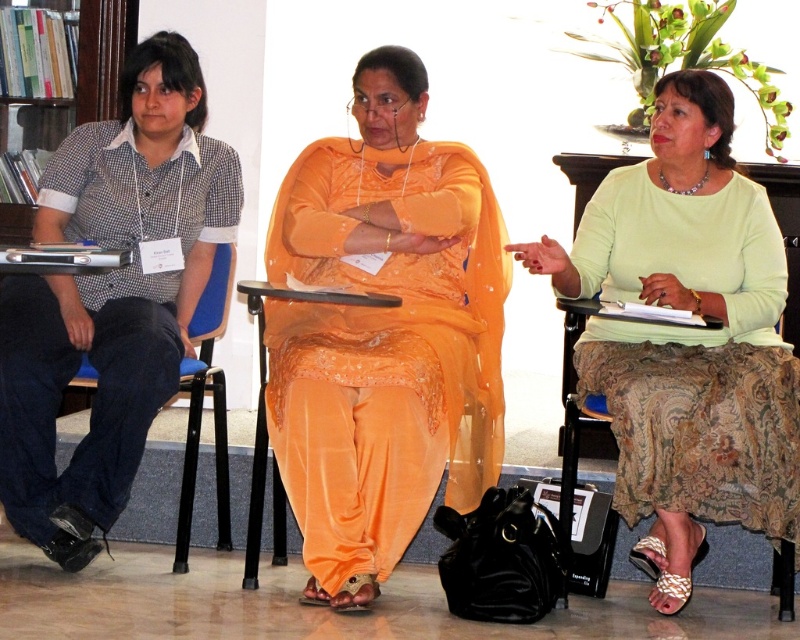
Question: Does orange silk dress at center lie behind green satin blouse at center?

Choices:
 (A) no
 (B) yes

Answer: (B)

Question: Which object is positioned closest to the paisley-patterned fabric chair at lower right?

Choices:
 (A) checkered fabric shirt at left
 (B) orange silk dress at center

Answer: (B)

Question: Which point is farther from the camera taking this photo?

Choices:
 (A) (52, 282)
 (B) (202, 346)
 (C) (570, 371)

Answer: (C)

Question: Is orange silk dress at center closer to camera compared to blue fabric chair at left?

Choices:
 (A) yes
 (B) no

Answer: (A)

Question: Which point is farther from the camera taking this photo?

Choices:
 (A) (634, 291)
 (B) (270, 410)
 (C) (92, 200)

Answer: (C)

Question: Does green satin blouse at center lie behind checkered fabric shirt at left?

Choices:
 (A) no
 (B) yes

Answer: (A)